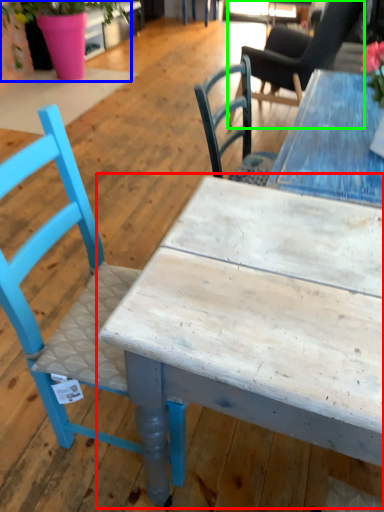
Question: Estimate the real-world distances between objects in this image. Which object is farther from table (highlighted by a red box), houseplant (highlighted by a blue box) or chair (highlighted by a green box)?

Choices:
 (A) houseplant
 (B) chair

Answer: (A)